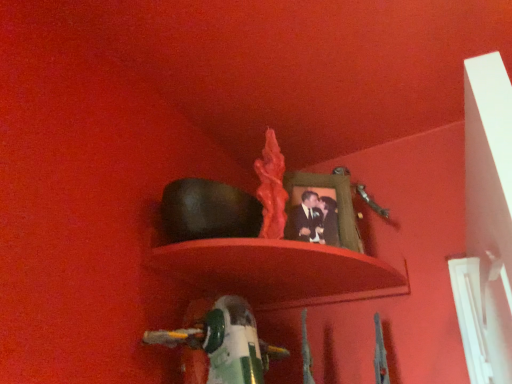
Question: In terms of height, does green plastic toy at lower center look taller or shorter compared to matte green picture frame at upper center?

Choices:
 (A) tall
 (B) short

Answer: (B)

Question: In terms of width, does green plastic toy at lower center look wider or thinner when compared to matte green picture frame at upper center?

Choices:
 (A) wide
 (B) thin

Answer: (A)

Question: Based on their relative distances, which object is nearer to the matte green picture frame at upper center?

Choices:
 (A) smooth matte shelf at center
 (B) green plastic toy at lower center

Answer: (A)

Question: Based on their relative distances, which object is nearer to the matte green picture frame at upper center?

Choices:
 (A) green plastic toy at lower center
 (B) smooth matte shelf at center

Answer: (B)